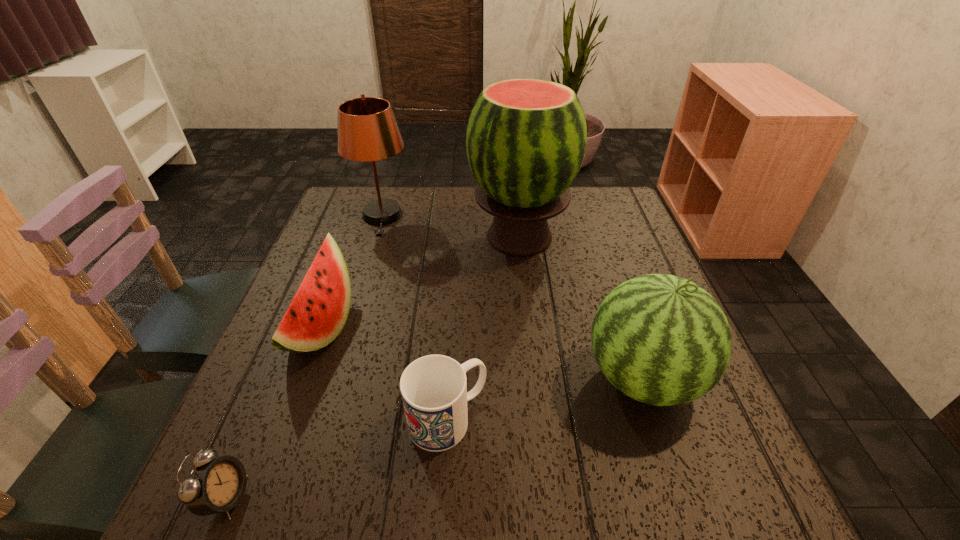
Identify the location of empty space that is in between the lampshade and the mug. Image resolution: width=960 pixels, height=540 pixels. (415, 318).

Locate an element on the screen. vacant area that lies between the tallest watermelon and the second shortest watermelon is located at coordinates (581, 307).

I want to click on free space between the third tallest object and the shortest watermelon, so click(482, 353).

This screenshot has width=960, height=540. I want to click on vacant region between the tallest watermelon and the lampshade, so click(x=450, y=226).

Where is `vacant space that's between the leftmost watermelon and the mug`? The width and height of the screenshot is (960, 540). vacant space that's between the leftmost watermelon and the mug is located at coordinates (385, 374).

This screenshot has height=540, width=960. Identify the location of free space between the second tallest watermelon and the fifth tallest object. (545, 399).

Where is `vacant space in between the farthest watermelon and the leftmost watermelon`? This screenshot has height=540, width=960. vacant space in between the farthest watermelon and the leftmost watermelon is located at coordinates (420, 282).

Point out which object is positioned as the second nearest to the lampshade. Please provide its 2D coordinates. Your answer should be formatted as a tuple, i.e. [(x, y)], where the tuple contains the x and y coordinates of a point satisfying the conditions above.

[(318, 312)]

Locate which object ranks fourth in proximity to the lampshade. Please provide its 2D coordinates. Your answer should be formatted as a tuple, i.e. [(x, y)], where the tuple contains the x and y coordinates of a point satisfying the conditions above.

[(660, 339)]

Find the location of `watermelon object that ranks as the second closest to the fourth shortest object`. watermelon object that ranks as the second closest to the fourth shortest object is located at coordinates (318, 312).